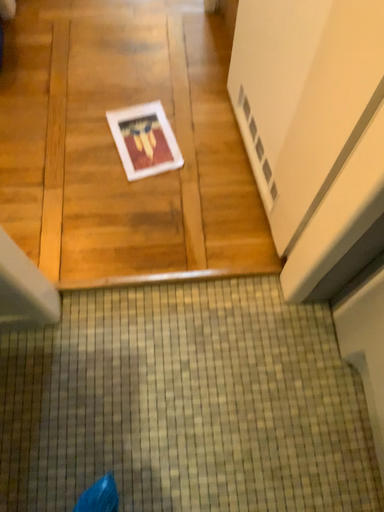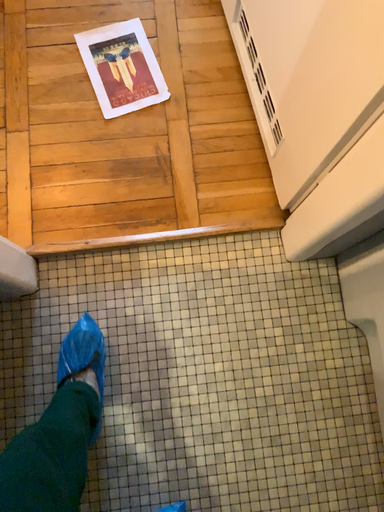
Question: How did the camera likely rotate when shooting the video?

Choices:
 (A) rotated upward
 (B) rotated downward

Answer: (B)